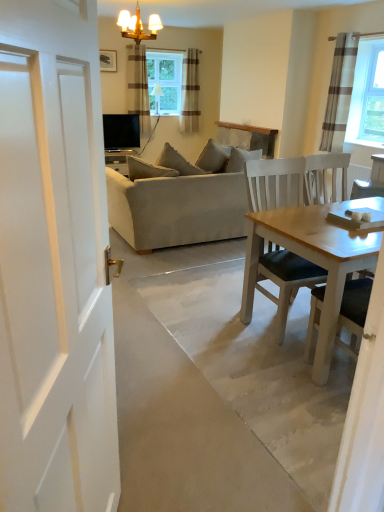
Describe the element at coordinates (311, 261) in the screenshot. I see `wooden table at right` at that location.

The image size is (384, 512). What do you see at coordinates (164, 81) in the screenshot? I see `clear glass window at upper center` at bounding box center [164, 81].

Locate an element on the screen. This screenshot has width=384, height=512. beige striped curtain at upper center, arranged as the second curtain when viewed from the left is located at coordinates (190, 91).

Locate an element on the screen. The width and height of the screenshot is (384, 512). gold metallic chandelier at upper center is located at coordinates (138, 25).

The width and height of the screenshot is (384, 512). What do you see at coordinates (176, 203) in the screenshot?
I see `beige fabric couch at center` at bounding box center [176, 203].

What is the approximate width of gray striped curtain at upper right, which appears as the 3th curtain when viewed from the left?

6.77 inches.

Find the location of a particular element. The image size is (384, 512). wooden table at right is located at coordinates (311, 261).

From the image's perspective, is gray striped curtain at upper right, which is the first curtain from right to left, under beige striped curtain at upper center, marked as the third curtain in a front-to-back arrangement?

Indeed, from the image's perspective, gray striped curtain at upper right, which is the first curtain from right to left, is shown beneath beige striped curtain at upper center, marked as the third curtain in a front-to-back arrangement.

Is gray striped curtain at upper right, acting as the third curtain starting from the back, positioned far away from beige striped curtain at upper center, marked as the third curtain in a front-to-back arrangement?

Yes, gray striped curtain at upper right, acting as the third curtain starting from the back, and beige striped curtain at upper center, marked as the third curtain in a front-to-back arrangement, are located far from each other.

Considering the relative sizes of gray striped curtain at upper right, which appears as the 3th curtain when viewed from the left, and beige striped curtain at upper center, the first curtain from the back, in the image provided, is gray striped curtain at upper right, which appears as the 3th curtain when viewed from the left, smaller than beige striped curtain at upper center, the first curtain from the back,?

Yes.

What are the coordinates of `window on the right of gold metallic chandelier at upper center` in the screenshot? It's located at (164, 81).

Is clear glass window at upper center with gold metallic chandelier at upper center?

No, clear glass window at upper center is not touching gold metallic chandelier at upper center.

Considering the positions of points (150, 66) and (129, 26), is point (150, 66) closer to camera compared to point (129, 26)?

No, it is not.

Consider the image. Is clear glass window at upper center shorter than gold metallic chandelier at upper center?

In fact, clear glass window at upper center may be taller than gold metallic chandelier at upper center.

How many degrees apart are the facing directions of beige fabric couch at center and clear glass window at upper center?

The angle between the facing direction of beige fabric couch at center and the facing direction of clear glass window at upper center is 179 degrees.

Between beige fabric couch at center and clear glass window at upper center, which one has less height?

clear glass window at upper center.

Based on their positions, is beige fabric couch at center located to the left or right of clear glass window at upper center?

From the image, it's evident that beige fabric couch at center is to the right of clear glass window at upper center.

How far apart are beige fabric couch at center and clear glass window at upper center?

The distance of beige fabric couch at center from clear glass window at upper center is 9.69 feet.

Are clear glass window at upper center and beige fabric couch at center located far from each other?

Yes, clear glass window at upper center is far from beige fabric couch at center.

Which object is positioned more to the left, clear glass window at upper center or beige fabric couch at center?

Positioned to the left is clear glass window at upper center.

From a real-world perspective, which object rests below the other?

From a 3D spatial view, beige fabric couch at center is below.

Considering the sizes of gold metallic chandelier at upper center and beige striped curtain at upper center, the first curtain from the back, in the image, is gold metallic chandelier at upper center wider or thinner than beige striped curtain at upper center, the first curtain from the back,?

Clearly, gold metallic chandelier at upper center has more width compared to beige striped curtain at upper center, the first curtain from the back.

Can beige striped curtain at upper center, arranged as the second curtain when viewed from the left, be found inside gold metallic chandelier at upper center?

No, beige striped curtain at upper center, arranged as the second curtain when viewed from the left, is not inside gold metallic chandelier at upper center.

Considering the positions of objects gold metallic chandelier at upper center and beige striped curtain at upper center, the first curtain from the back, in the image provided, who is more to the right, gold metallic chandelier at upper center or beige striped curtain at upper center, the first curtain from the back,?

beige striped curtain at upper center, the first curtain from the back, is more to the right.

Is beige fabric couch at center facing towards beige striped curtain at upper center, the first curtain from the back?

Yes, beige fabric couch at center is oriented towards beige striped curtain at upper center, the first curtain from the back.

Is beige fabric couch at center inside the boundaries of beige striped curtain at upper center, arranged as the 2th curtain when viewed from the right, or outside?

beige fabric couch at center cannot be found inside beige striped curtain at upper center, arranged as the 2th curtain when viewed from the right.

From the picture: Is beige fabric couch at center positioned far away from beige striped curtain at upper center, the first curtain from the back?

Indeed, beige fabric couch at center is not near beige striped curtain at upper center, the first curtain from the back.

Considering the positions of objects beige fabric couch at center and beige striped curtain at upper center, arranged as the second curtain when viewed from the left, in the image provided, who is more to the left, beige fabric couch at center or beige striped curtain at upper center, arranged as the second curtain when viewed from the left,?

From the viewer's perspective, beige striped curtain at upper center, arranged as the second curtain when viewed from the left, appears more on the left side.

Who is shorter, wooden table at right or gold metallic chandelier at upper center?

gold metallic chandelier at upper center.

Based on their sizes in the image, would you say wooden table at right is bigger or smaller than gold metallic chandelier at upper center?

wooden table at right is bigger than gold metallic chandelier at upper center.

Which is closer to the camera, (318, 215) or (129, 21)?

Point (318, 215) is closer to the camera than point (129, 21).

Image resolution: width=384 pixels, height=512 pixels. Find the location of `curtain that appears on the right of beige striped curtain at upper center, the first curtain from the back`. curtain that appears on the right of beige striped curtain at upper center, the first curtain from the back is located at coordinates (339, 92).

The image size is (384, 512). Identify the location of window behind the gold metallic chandelier at upper center. (164, 81).

When comparing their distances from wooden table at right, does beige fabric couch at center or beige striped curtain at upper center, the first curtain from the back, seem further?

beige striped curtain at upper center, the first curtain from the back, lies further to wooden table at right than the other object.

Estimate the real-world distances between objects in this image. Which object is further from clear glass window at upper center, gold metallic chandelier at upper center or wooden table at right?

wooden table at right.

When comparing their distances from sheer brown striped curtain at upper center, placed as the second curtain when sorted from back to front, does gray striped curtain at upper right, acting as the 1th curtain starting from the front, or beige striped curtain at upper center, arranged as the 2th curtain when viewed from the right, seem closer?

beige striped curtain at upper center, arranged as the 2th curtain when viewed from the right, lies closer to sheer brown striped curtain at upper center, placed as the second curtain when sorted from back to front, than the other object.

Which object lies further to the anchor point gold metallic chandelier at upper center, sheer brown striped curtain at upper center, placed as the second curtain when sorted from back to front, or gray striped curtain at upper right, which appears as the 3th curtain when viewed from the left?

The object further to gold metallic chandelier at upper center is gray striped curtain at upper right, which appears as the 3th curtain when viewed from the left.

Which object lies nearer to the anchor point gray striped curtain at upper right, acting as the 1th curtain starting from the front, sheer brown striped curtain at upper center, which appears as the second curtain when viewed from the front, or gold metallic chandelier at upper center?

gold metallic chandelier at upper center lies closer to gray striped curtain at upper right, acting as the 1th curtain starting from the front, than the other object.

Based on their spatial positions, is gray striped curtain at upper right, acting as the 1th curtain starting from the front, or clear glass window at upper center closer to gold metallic chandelier at upper center?

Among the two, clear glass window at upper center is located nearer to gold metallic chandelier at upper center.

Which object lies nearer to the anchor point gray striped curtain at upper right, which is the first curtain from right to left, wooden table at right or beige striped curtain at upper center, the first curtain from the back?

beige striped curtain at upper center, the first curtain from the back, is positioned closer to the anchor gray striped curtain at upper right, which is the first curtain from right to left.

Which object lies nearer to the anchor point wooden table at right, clear glass window at upper center or gray striped curtain at upper right, acting as the 1th curtain starting from the front?

gray striped curtain at upper right, acting as the 1th curtain starting from the front.

This screenshot has width=384, height=512. Identify the location of light fixture between wooden table at right and beige striped curtain at upper center, the first curtain from the back, in the front-back direction. (138, 25).

This screenshot has width=384, height=512. Identify the location of curtain located between beige fabric couch at center and sheer brown striped curtain at upper center, placed as the 1th curtain when sorted from left to right, in the depth direction. (339, 92).

What are the coordinates of `studio couch situated between gold metallic chandelier at upper center and gray striped curtain at upper right, acting as the 1th curtain starting from the front, from left to right` in the screenshot? It's located at (176, 203).

Where is `light fixture located between beige fabric couch at center and sheer brown striped curtain at upper center, acting as the third curtain starting from the right, in the depth direction`? The width and height of the screenshot is (384, 512). light fixture located between beige fabric couch at center and sheer brown striped curtain at upper center, acting as the third curtain starting from the right, in the depth direction is located at coordinates (138, 25).